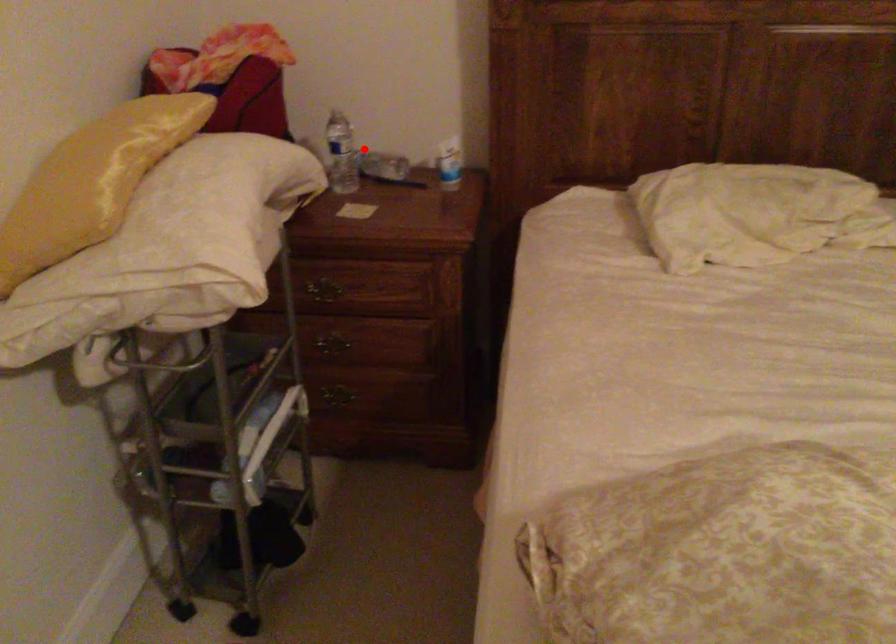
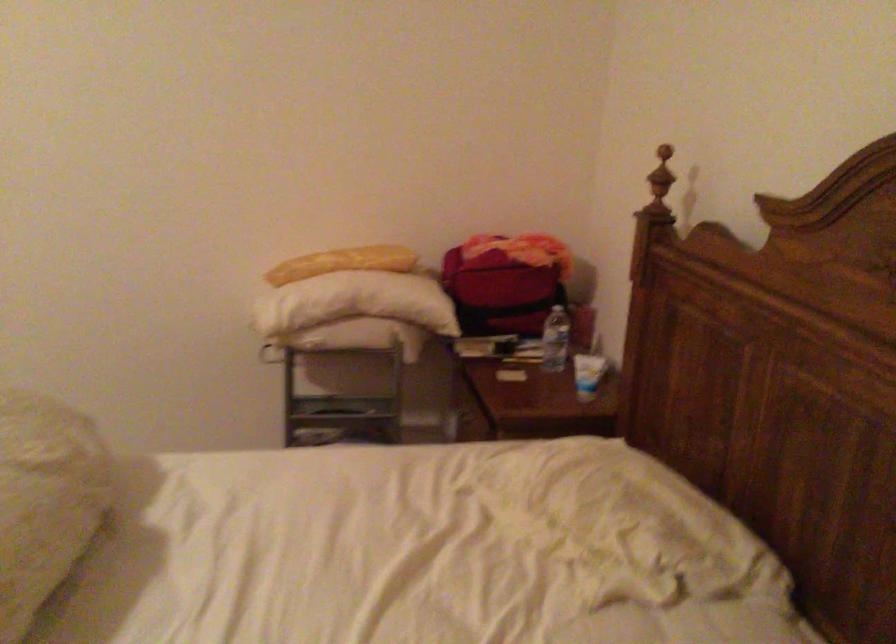
Find the pixel in the second image that matches the highlighted location in the first image.

(556, 339)